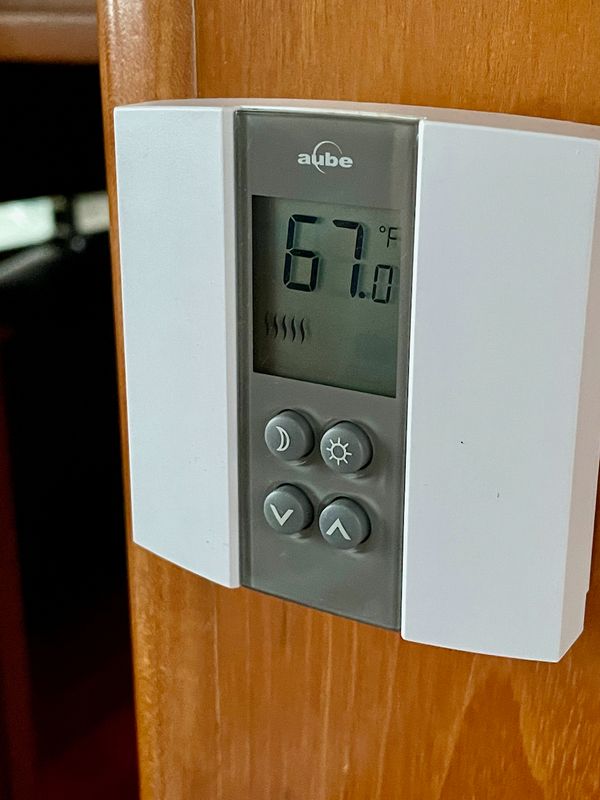
Where is `light wood grain`? light wood grain is located at coordinates (216, 690), (248, 665), (266, 662), (287, 652), (307, 650), (330, 654), (356, 658).